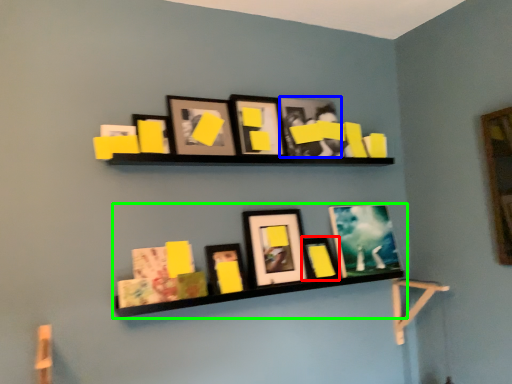
Question: Which object is the farthest from picture frame (highlighted by a red box)? Choose among these: picture frame (highlighted by a blue box) or shelf (highlighted by a green box).

Choices:
 (A) picture frame
 (B) shelf

Answer: (A)